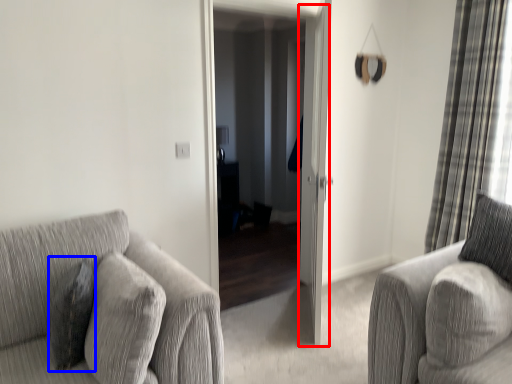
Question: Which of the following is the farthest to the observer, screen door (highlighted by a red box) or pillow (highlighted by a blue box)?

Choices:
 (A) screen door
 (B) pillow

Answer: (A)